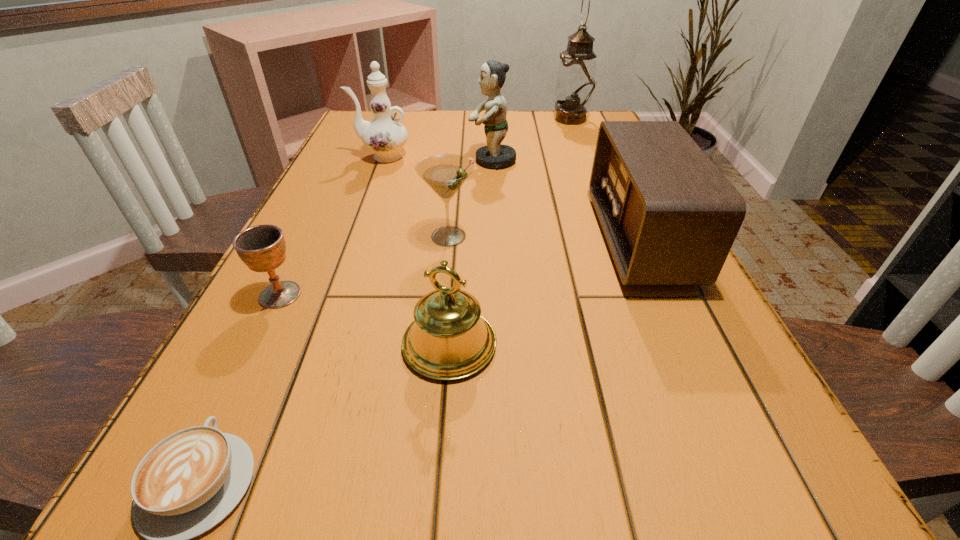
Identify the location of free space located 0.180m on the front-facing side of the figurine. (400, 160).

This screenshot has height=540, width=960. I want to click on vacant area located 0.360m on the front-facing side of the figurine, so click(x=332, y=160).

Find the location of a particular element. vacant region located at the spout of the chinaware is located at coordinates (335, 157).

Find the location of a particular element. The width and height of the screenshot is (960, 540). free region located on the front-facing side of the radio receiver is located at coordinates (445, 239).

Where is `blank area located on the front-facing side of the radio receiver`? blank area located on the front-facing side of the radio receiver is located at coordinates (426, 239).

Locate an element on the screen. This screenshot has width=960, height=540. vacant space located 0.400m on the front-facing side of the radio receiver is located at coordinates (406, 239).

I want to click on vacant region located on the back of the martini, so click(x=454, y=179).

Find the location of `vacant space situated 0.090m on the front of the bell`. vacant space situated 0.090m on the front of the bell is located at coordinates [443, 443].

You are a GUI agent. You are given a task and a screenshot of the screen. Output one action in this format:
    pyautogui.click(x=<x>, y=<y>)
    Task: Click on the blank space located 0.090m on the back of the chalice
    Image resolution: width=960 pixels, height=540 pixels.
    Given the screenshot: What is the action you would take?
    pyautogui.click(x=302, y=251)

Locate an element on the screen. This screenshot has height=540, width=960. object that is at the far edge is located at coordinates (576, 82).